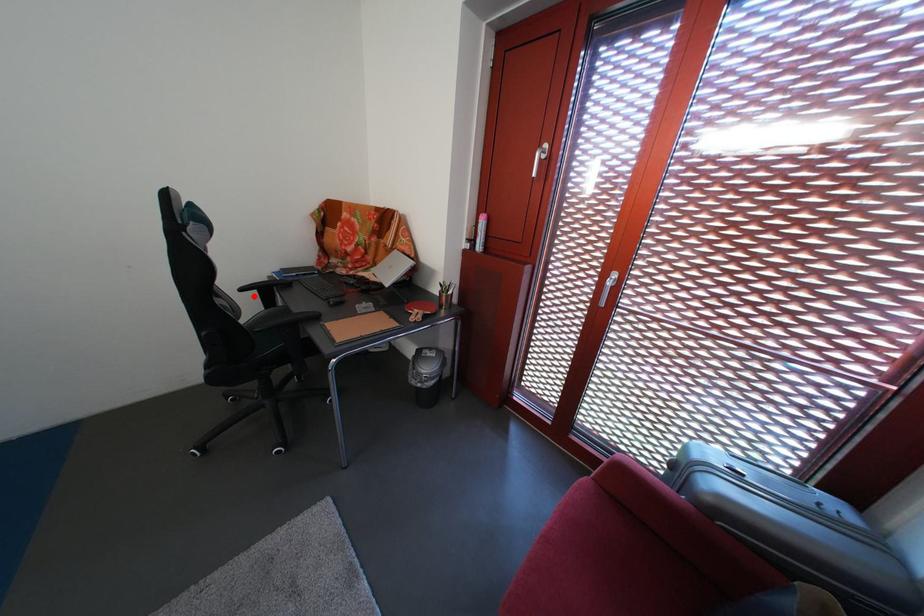
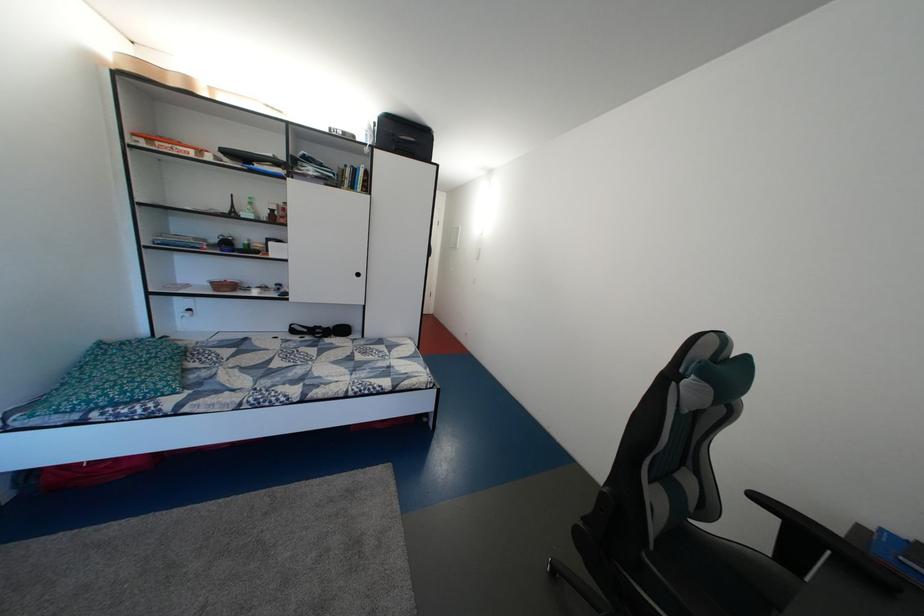
Question: I am providing you with two images of the same scene from different viewpoints. In image1, a red point is highlighted. Considering the same 3D point in image2, which of the following is correct?

Choices:
 (A) It is closer
 (B) It is farther

Answer: (B)